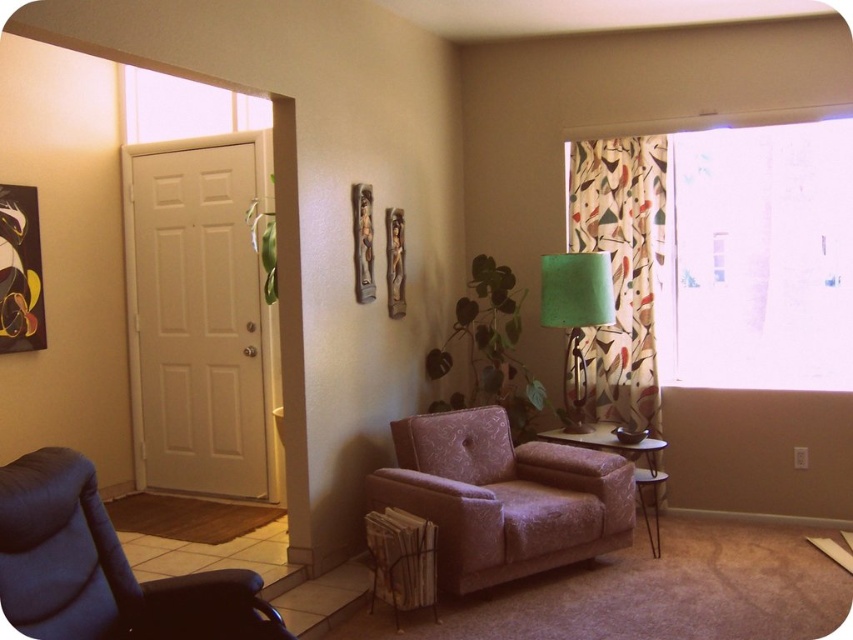
Question: Does transparent glass window at upper right have a larger size compared to patterned fabric curtain at right?

Choices:
 (A) yes
 (B) no

Answer: (A)

Question: Among these objects, which one is nearest to the camera?

Choices:
 (A) pink textured couch at center
 (B) transparent glass window at upper right
 (C) green fabric lampshade at upper right

Answer: (A)

Question: In this image, where is blue fabric swivel chair at lower left located relative to green fabric lampshade at upper right?

Choices:
 (A) right
 (B) left

Answer: (B)

Question: Which point is farther to the camera?

Choices:
 (A) (595, 381)
 (B) (440, 561)
 (C) (755, 164)

Answer: (A)

Question: Which object is positioned closest to the patterned fabric curtain at right?

Choices:
 (A) pink textured couch at center
 (B) green fabric lampshade at upper right

Answer: (B)

Question: Does transparent glass window at upper right appear on the left side of pink textured couch at center?

Choices:
 (A) yes
 (B) no

Answer: (B)